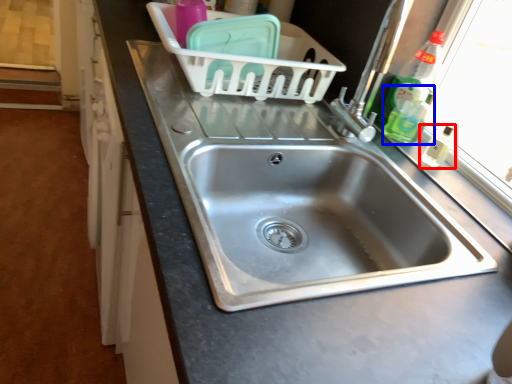
Question: Which of the following is the farthest to the observer, toiletry (highlighted by a red box) or bottle (highlighted by a blue box)?

Choices:
 (A) toiletry
 (B) bottle

Answer: (B)